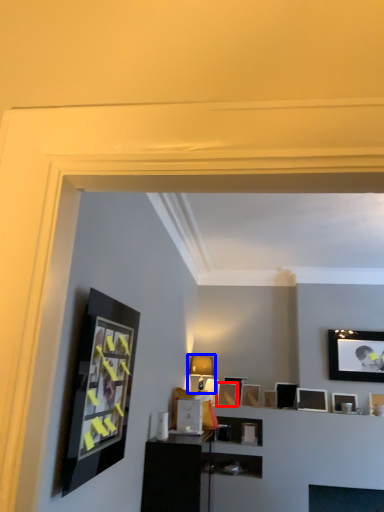
Question: Which point is further to the camera, picture frame (highlighted by a red box) or lamp (highlighted by a blue box)?

Choices:
 (A) picture frame
 (B) lamp

Answer: (A)